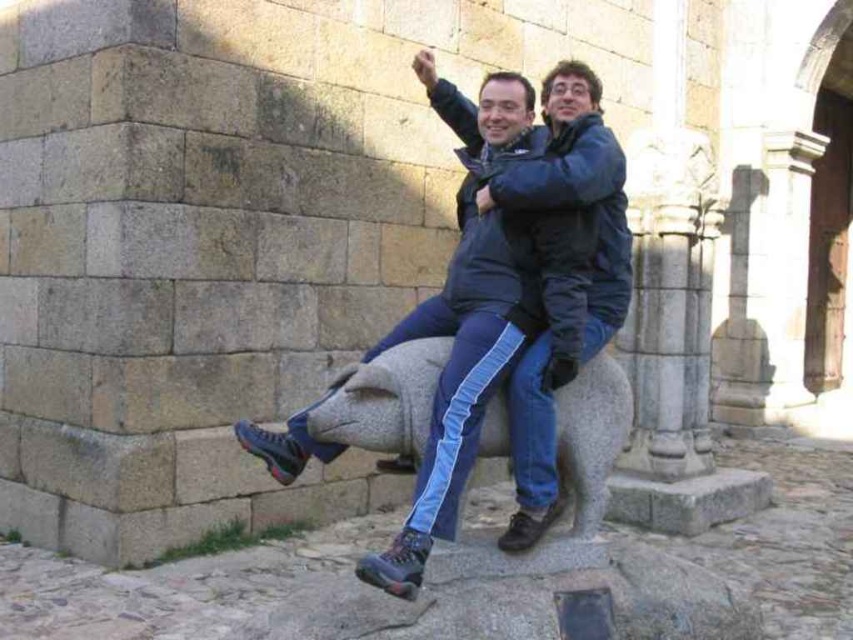
Is matte black jacket at center above gray stone pig at center?

Indeed, matte black jacket at center is positioned over gray stone pig at center.

The image size is (853, 640). Identify the location of matte black jacket at center. (486, 285).

Image resolution: width=853 pixels, height=640 pixels. What are the coordinates of `matte black jacket at center` in the screenshot? It's located at (486, 285).